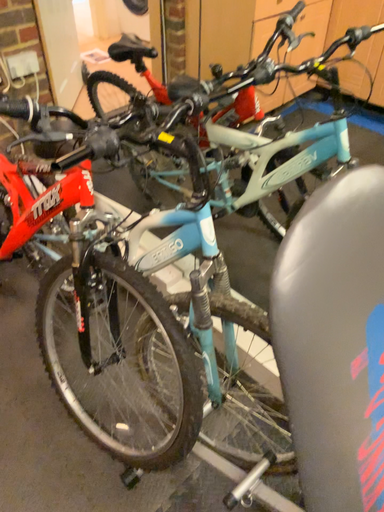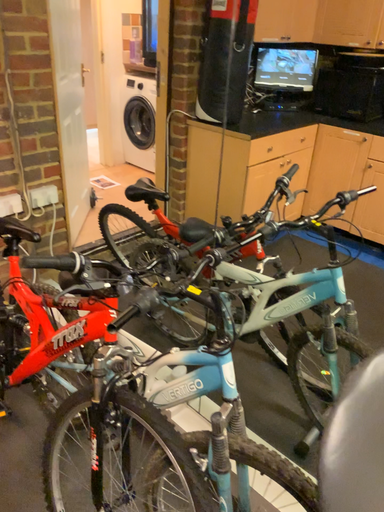
Question: Which way did the camera rotate in the video?

Choices:
 (A) rotated downward
 (B) rotated upward

Answer: (B)